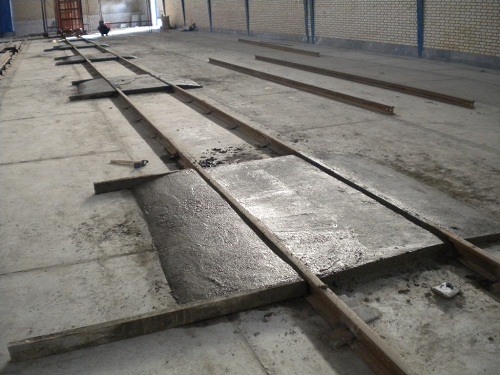
Locate an element on the screen. wall borders is located at coordinates (423, 18), (314, 22), (307, 15), (248, 14), (211, 13), (185, 8), (166, 6).